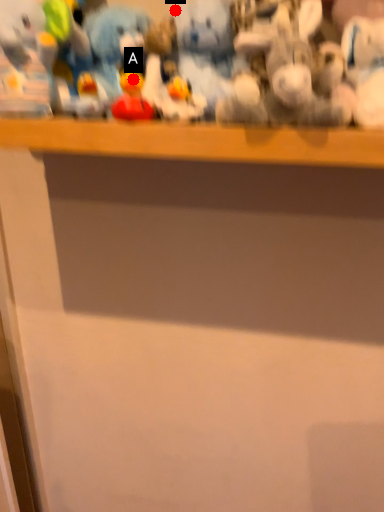
Question: Two points are circled on the image, labeled by A and B beside each circle. Which of the following is the closest to the observer?

Choices:
 (A) A is closer
 (B) B is closer

Answer: (A)